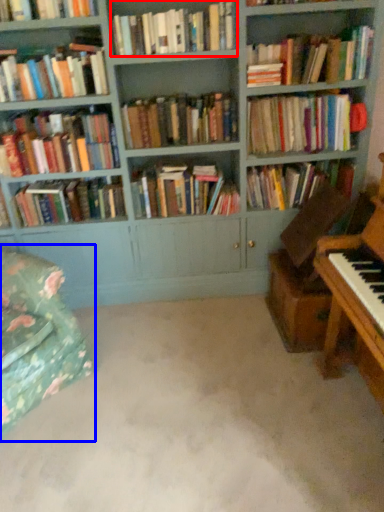
Question: Which of the following is the closest to the observer, book (highlighted by a red box) or swivel chair (highlighted by a blue box)?

Choices:
 (A) book
 (B) swivel chair

Answer: (B)